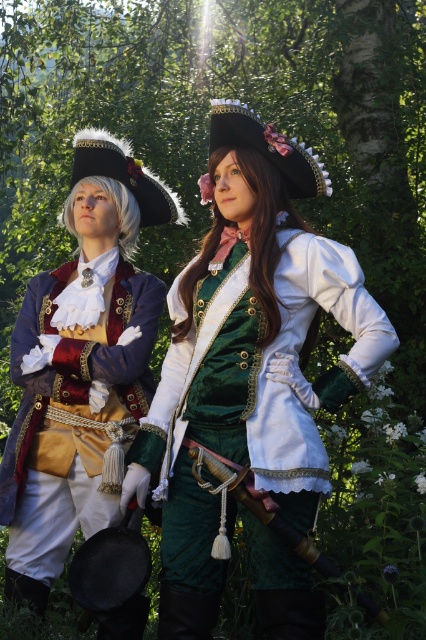
Does green velvet jacket at center appear over green velvet coat at center?

Yes.

Which of these two, green velvet jacket at center or green velvet coat at center, stands taller?

green velvet coat at center

Which is in front, point (173, 632) or point (11, 541)?

Point (173, 632) is more forward.

Where is `green velvet jacket at center`? The image size is (426, 640). green velvet jacket at center is located at coordinates (247, 356).